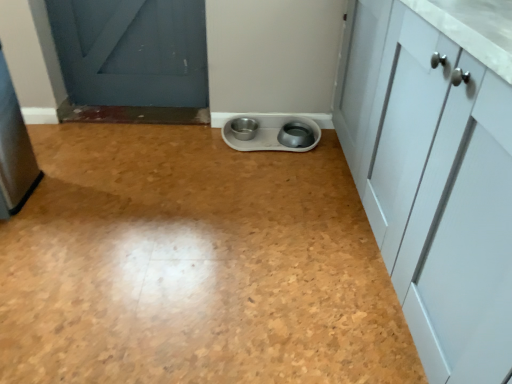
Question: Can you confirm if white plastic pet bowls at center is wider than brushed metal refrigerator at left, marked as the second appliance in a right-to-left arrangement?

Choices:
 (A) no
 (B) yes

Answer: (B)

Question: Is white plastic pet bowls at center far from brushed metal refrigerator at left, marked as the second appliance in a right-to-left arrangement?

Choices:
 (A) no
 (B) yes

Answer: (A)

Question: Is white plastic pet bowls at center facing towards brushed metal refrigerator at left, positioned as the 1th appliance in front-to-back order?

Choices:
 (A) no
 (B) yes

Answer: (A)

Question: Is white plastic pet bowls at center positioned with its back to brushed metal refrigerator at left, the 2th appliance when ordered from back to front?

Choices:
 (A) yes
 (B) no

Answer: (B)

Question: From a real-world perspective, is white plastic pet bowls at center positioned over brushed metal refrigerator at left, marked as the second appliance in a right-to-left arrangement, based on gravity?

Choices:
 (A) no
 (B) yes

Answer: (A)

Question: Is white plastic pet bowls at center at the left side of brushed metal refrigerator at left, marked as the second appliance in a right-to-left arrangement?

Choices:
 (A) yes
 (B) no

Answer: (B)

Question: Is brushed metal refrigerator at left, the 2th appliance when ordered from back to front, positioned before white plastic pet bowls at center?

Choices:
 (A) yes
 (B) no

Answer: (B)

Question: Is brushed metal refrigerator at left, the 2th appliance when ordered from back to front, turned away from white plastic pet bowls at center?

Choices:
 (A) yes
 (B) no

Answer: (B)

Question: Is white plastic pet bowls at center completely or partially inside brushed metal refrigerator at left, positioned as the 1th appliance in front-to-back order?

Choices:
 (A) no
 (B) yes

Answer: (A)

Question: From a real-world perspective, is brushed metal refrigerator at left, marked as the second appliance in a right-to-left arrangement, physically above white plastic pet bowls at center?

Choices:
 (A) yes
 (B) no

Answer: (A)

Question: Can you confirm if brushed metal refrigerator at left, marked as the first appliance in a left-to-right arrangement, is shorter than white plastic pet bowls at center?

Choices:
 (A) no
 (B) yes

Answer: (A)

Question: Can you confirm if brushed metal refrigerator at left, positioned as the 1th appliance in front-to-back order, is thinner than white plastic pet bowls at center?

Choices:
 (A) no
 (B) yes

Answer: (B)

Question: From the image's perspective, does metallic gray bowls at center, acting as the 1th appliance starting from the right, appear higher than brushed metal refrigerator at left, marked as the first appliance in a left-to-right arrangement?

Choices:
 (A) yes
 (B) no

Answer: (A)